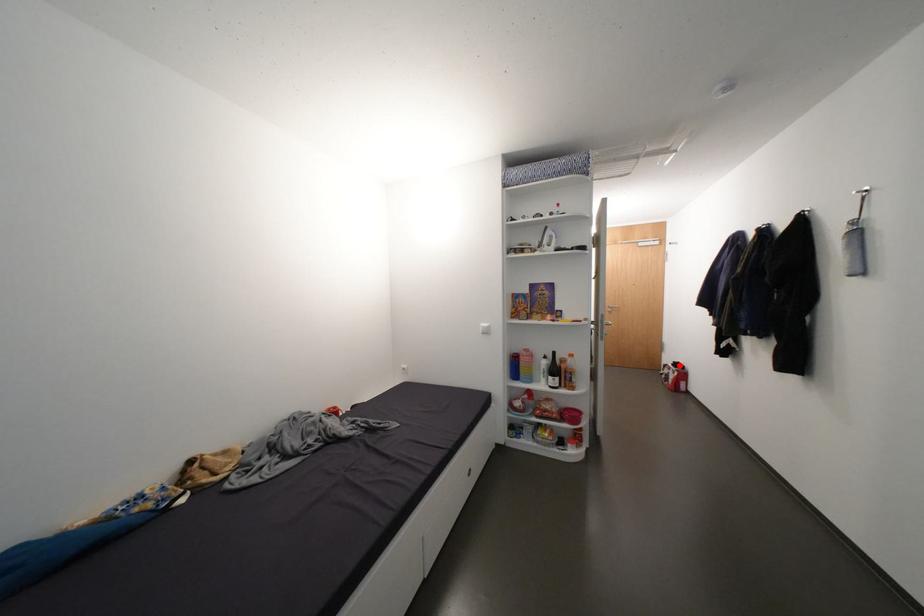
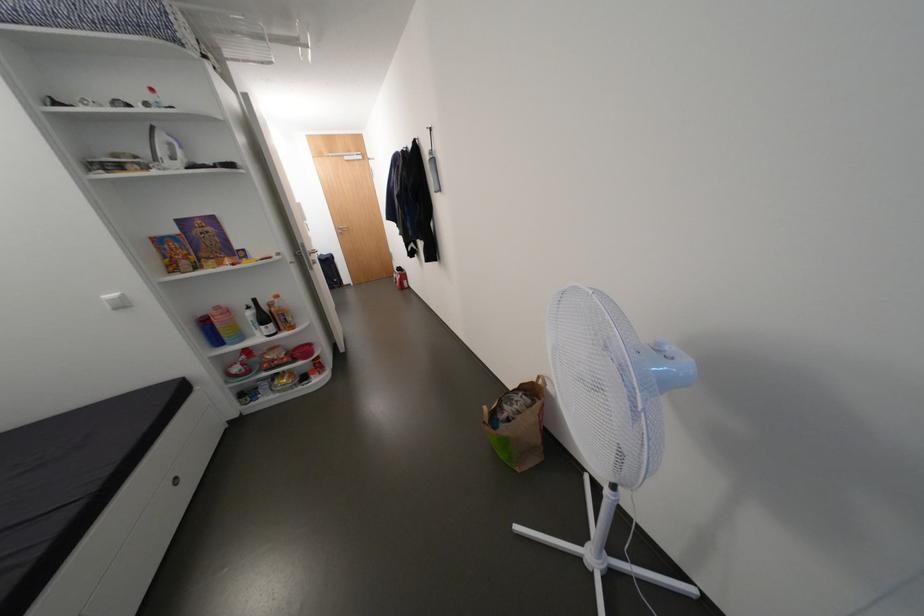
Question: I am providing you with two images of the same scene from different viewpoints. Given a red point in image1, look at the same physical point in image2. Is it:

Choices:
 (A) Closer to the viewpoint
 (B) Farther from the viewpoint

Answer: (A)